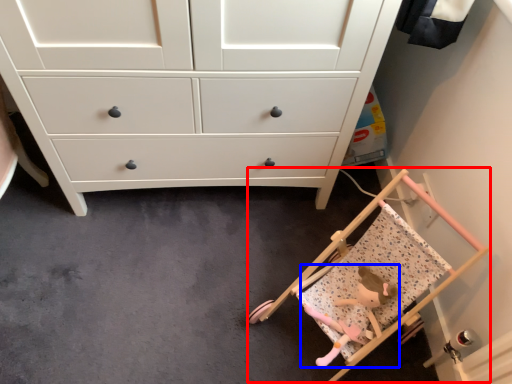
Question: Which of the following is the farthest to the observer, baby carriage (highlighted by a red box) or toy (highlighted by a blue box)?

Choices:
 (A) baby carriage
 (B) toy

Answer: (B)